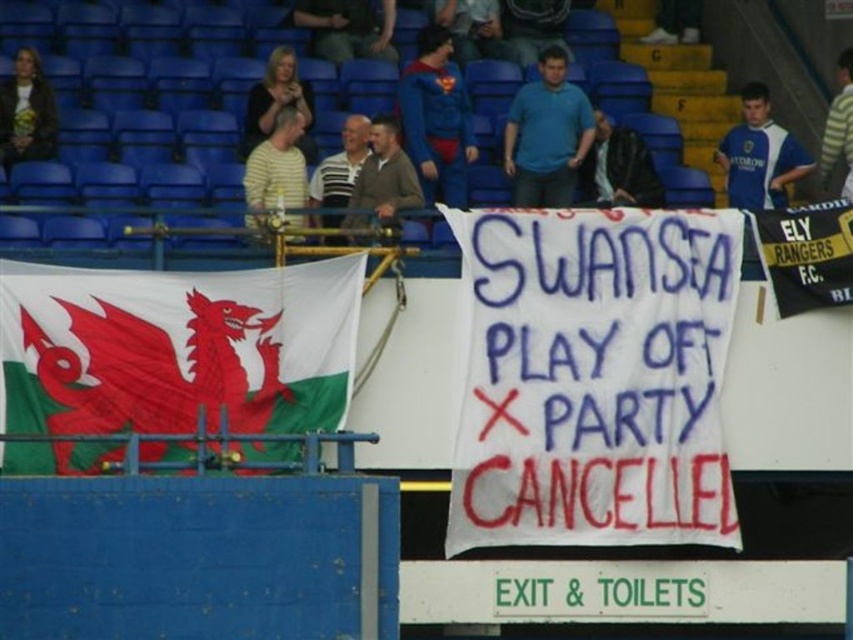
Describe the element at coordinates (177, 348) in the screenshot. This screenshot has height=640, width=853. I see `white fabric flag at left` at that location.

Which is behind, point (74, 326) or point (836, 280)?

Positioned behind is point (836, 280).

Who is more forward, [312,358] or [798,301]?

Point [312,358] is in front.

Identify the location of white fabric flag at left. (177, 348).

Is point (465, 516) positioned after point (836, 253)?

That is False.

Is white fabric banner at center in front of black jersey at right?

That is True.

Which is in front, point (550, 259) or point (763, 248)?

Point (550, 259)

The height and width of the screenshot is (640, 853). What are the coordinates of `white fabric banner at center` in the screenshot? It's located at (595, 378).

Image resolution: width=853 pixels, height=640 pixels. I want to click on white fabric banner at center, so click(x=595, y=378).